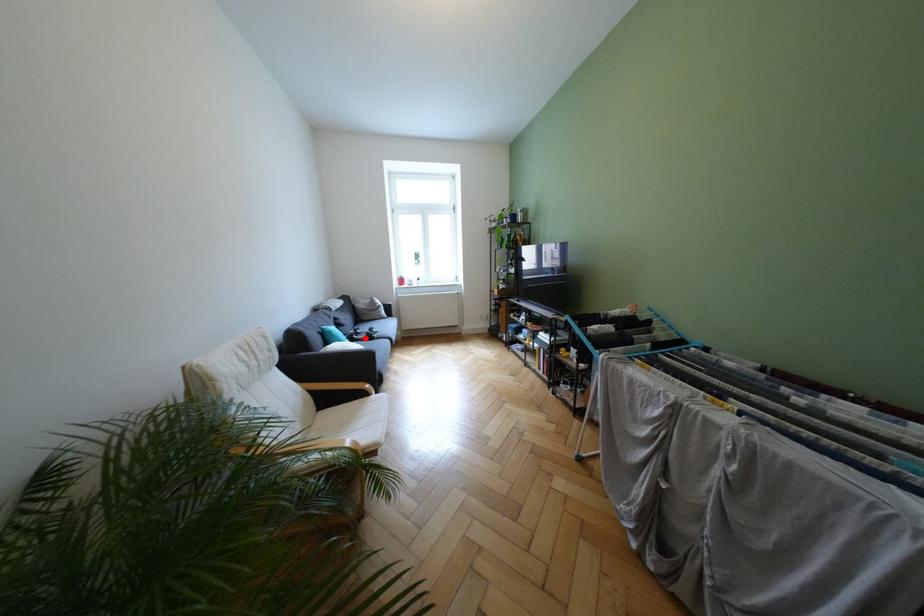
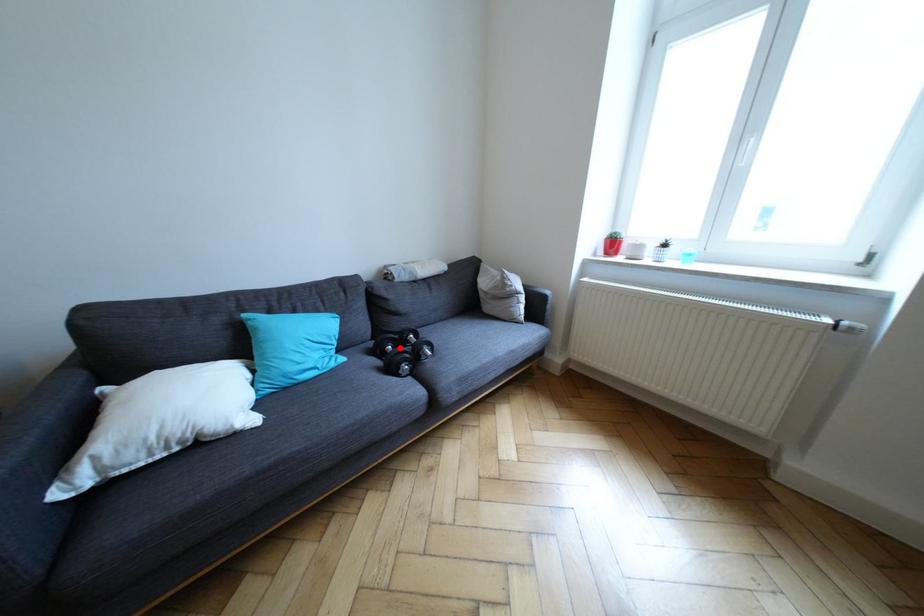
I am providing you with two images of the same scene from different viewpoints. A red point is marked on the first image and another point is marked on the second image. Do the highlighted points in image1 and image2 indicate the same real-world spot?

Yes